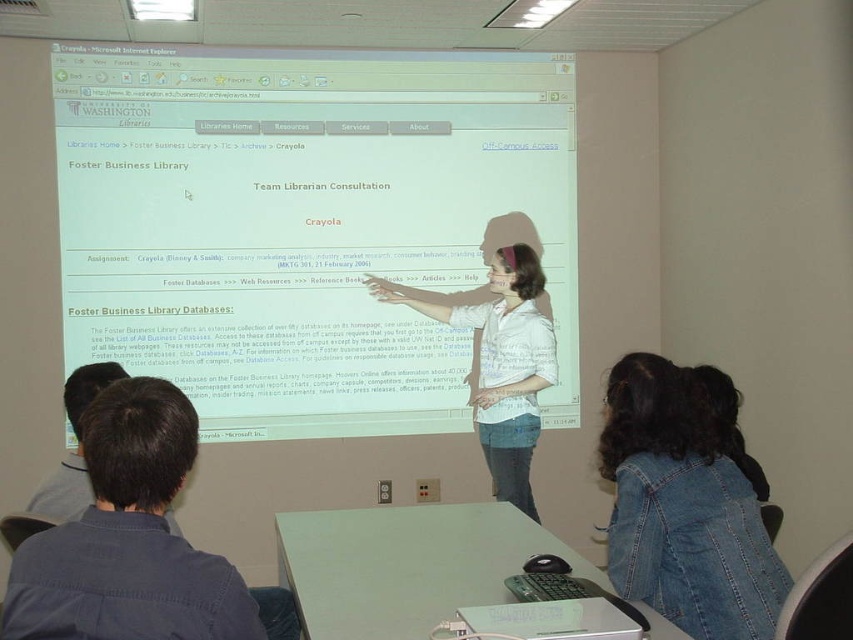
You are a student in the classroom. You want to hand your assignment to the professor who is standing behind the white glossy projection screen at upper center. However, there is a denim jacket at lower right in the way. Can you reach the professor without moving the denim jacket?

The denim jacket at lower right is behind the white glossy projection screen at upper center, so it is not blocking your path. You can reach the professor without moving the denim jacket.

You are a student sitting in the classroom and need to take a photo of the white glossy projection screen at upper center and the white striped shirt at center for your notes. Which object should you focus on first if you want to capture both in one frame without moving the camera?

Result: The white glossy projection screen at upper center has a greater height compared to the white striped shirt at center, so you should focus on the white glossy projection screen at upper center first to ensure both are in frame.

You are standing in the classroom facing the projection screen. Where is the denim jacket at lower right located in relation to the screen?

The denim jacket at lower right is located at the 2D coordinates point (682, 508) relative to the screen.